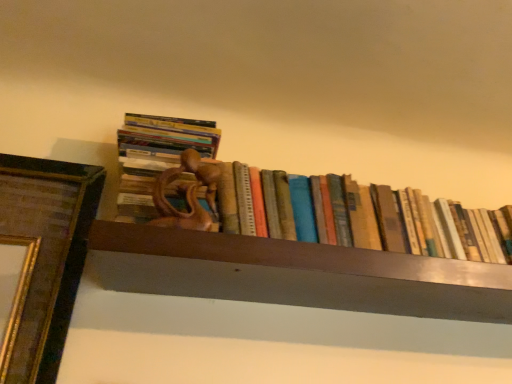
What do you see at coordinates (291, 200) in the screenshot?
I see `old paper book at center, which is the second book in left-to-right order` at bounding box center [291, 200].

Measure the distance between point (x=216, y=219) and camera.

Point (x=216, y=219) is 32.83 inches away from camera.

The height and width of the screenshot is (384, 512). Identify the location of old paper book at center, which is the second book in left-to-right order. (291, 200).

Describe the element at coordinates (165, 152) in the screenshot. I see `wooden statue at center, which is the 1th book from left to right` at that location.

This screenshot has height=384, width=512. Find the location of `wooden statue at center, which is the 1th book from left to right`. wooden statue at center, which is the 1th book from left to right is located at coordinates (165, 152).

Where is `old paper book at center, which is the second book in left-to-right order`? This screenshot has height=384, width=512. old paper book at center, which is the second book in left-to-right order is located at coordinates (291, 200).

Looking at this image, between old paper book at center, which is the second book in left-to-right order, and wooden statue at center, acting as the second book starting from the right, which one appears on the right side from the viewer's perspective?

From the viewer's perspective, old paper book at center, which is the second book in left-to-right order, appears more on the right side.

Is old paper book at center, which is the second book in left-to-right order, in front of or behind wooden statue at center, acting as the second book starting from the right, in the image?

In the image, old paper book at center, which is the second book in left-to-right order, appears behind wooden statue at center, acting as the second book starting from the right.

Does point (222, 185) come behind point (196, 167)?

No.

From the image's perspective, is old paper book at center, which is the second book in left-to-right order, on top of wooden statue at center, which is the 1th book from left to right?

No, from the image's perspective, old paper book at center, which is the second book in left-to-right order, is not on top of wooden statue at center, which is the 1th book from left to right.

Based on the photo, from a real-world perspective, is old paper book at center, the first book in the right-to-left sequence, below wooden statue at center, acting as the second book starting from the right?

Yes, from a real-world perspective, old paper book at center, the first book in the right-to-left sequence, is below wooden statue at center, acting as the second book starting from the right.

Considering the relative sizes of old paper book at center, the first book in the right-to-left sequence, and wooden statue at center, acting as the second book starting from the right, in the image provided, is old paper book at center, the first book in the right-to-left sequence, wider than wooden statue at center, acting as the second book starting from the right,?

No, old paper book at center, the first book in the right-to-left sequence, is not wider than wooden statue at center, acting as the second book starting from the right.

Who is shorter, old paper book at center, which is the second book in left-to-right order, or wooden statue at center, acting as the second book starting from the right?

old paper book at center, which is the second book in left-to-right order, is shorter.

Who is bigger, old paper book at center, the first book in the right-to-left sequence, or wooden statue at center, acting as the second book starting from the right?

Bigger between the two is old paper book at center, the first book in the right-to-left sequence.

Looking at this image, is old paper book at center, which is the second book in left-to-right order, inside or outside of wooden statue at center, acting as the second book starting from the right?

old paper book at center, which is the second book in left-to-right order, is not inside wooden statue at center, acting as the second book starting from the right, it's outside.

Is old paper book at center, the first book in the right-to-left sequence, next to wooden statue at center, acting as the second book starting from the right?

There is a gap between old paper book at center, the first book in the right-to-left sequence, and wooden statue at center, acting as the second book starting from the right.

Is old paper book at center, the first book in the right-to-left sequence, facing away from wooden statue at center, which is the 1th book from left to right?

No, old paper book at center, the first book in the right-to-left sequence, is not facing away from wooden statue at center, which is the 1th book from left to right.

Where is `book below the wooden statue at center, which is the 1th book from left to right (from a real-world perspective)`? The width and height of the screenshot is (512, 384). book below the wooden statue at center, which is the 1th book from left to right (from a real-world perspective) is located at coordinates [291, 200].

From the picture: Is wooden statue at center, which is the 1th book from left to right, at the left side of old paper book at center, the first book in the right-to-left sequence?

Correct, you'll find wooden statue at center, which is the 1th book from left to right, to the left of old paper book at center, the first book in the right-to-left sequence.

Is wooden statue at center, acting as the second book starting from the right, positioned behind old paper book at center, the first book in the right-to-left sequence?

No.

Is point (163, 152) closer or farther from the camera than point (198, 134)?

Point (163, 152).

From the image's perspective, is wooden statue at center, which is the 1th book from left to right, located beneath old paper book at center, which is the second book in left-to-right order?

No.

From a real-world perspective, which object stands above the other?

From a 3D spatial view, wooden statue at center, which is the 1th book from left to right, is above.

Which of these two, wooden statue at center, which is the 1th book from left to right, or old paper book at center, which is the second book in left-to-right order, is thinner?

old paper book at center, which is the second book in left-to-right order.

Can you confirm if wooden statue at center, which is the 1th book from left to right, is shorter than old paper book at center, which is the second book in left-to-right order?

In fact, wooden statue at center, which is the 1th book from left to right, may be taller than old paper book at center, which is the second book in left-to-right order.

Between wooden statue at center, which is the 1th book from left to right, and old paper book at center, which is the second book in left-to-right order, which one has smaller size?

wooden statue at center, which is the 1th book from left to right.

Is wooden statue at center, which is the 1th book from left to right, not within old paper book at center, which is the second book in left-to-right order?

Yes, wooden statue at center, which is the 1th book from left to right, is outside of old paper book at center, which is the second book in left-to-right order.

Is wooden statue at center, which is the 1th book from left to right, in contact with old paper book at center, which is the second book in left-to-right order?

No, wooden statue at center, which is the 1th book from left to right, is not making contact with old paper book at center, which is the second book in left-to-right order.

Is wooden statue at center, which is the 1th book from left to right, oriented towards old paper book at center, the first book in the right-to-left sequence?

No, wooden statue at center, which is the 1th book from left to right, is not turned towards old paper book at center, the first book in the right-to-left sequence.

How many degrees apart are the facing directions of wooden statue at center, acting as the second book starting from the right, and old paper book at center, which is the second book in left-to-right order?

The facing directions of wooden statue at center, acting as the second book starting from the right, and old paper book at center, which is the second book in left-to-right order, are 1.2 degrees apart.

Identify the location of book above the old paper book at center, the first book in the right-to-left sequence (from the image's perspective). (165, 152).

Where is `book in front of the old paper book at center, the first book in the right-to-left sequence`? This screenshot has width=512, height=384. book in front of the old paper book at center, the first book in the right-to-left sequence is located at coordinates (165, 152).

The width and height of the screenshot is (512, 384). Identify the location of book located on the right of wooden statue at center, which is the 1th book from left to right. (291, 200).